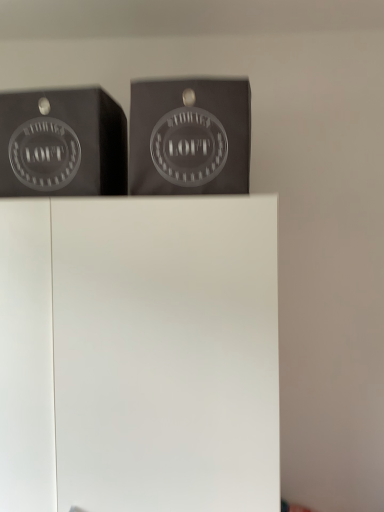
Question: Can you confirm if matte black box at upper center is shorter than matte black logo at upper left?

Choices:
 (A) yes
 (B) no

Answer: (B)

Question: Is matte black box at upper center looking in the opposite direction of matte black logo at upper left?

Choices:
 (A) no
 (B) yes

Answer: (A)

Question: Does matte black box at upper center have a larger size compared to matte black logo at upper left?

Choices:
 (A) yes
 (B) no

Answer: (A)

Question: Is matte black box at upper center outside of matte black logo at upper left?

Choices:
 (A) no
 (B) yes

Answer: (B)

Question: From a real-world perspective, is matte black box at upper center over matte black logo at upper left?

Choices:
 (A) yes
 (B) no

Answer: (B)

Question: Considering the relative positions of matte black logo at upper left and matte black box at upper center in the image provided, is matte black logo at upper left to the left or to the right of matte black box at upper center?

Choices:
 (A) right
 (B) left

Answer: (B)

Question: Is point (16, 161) closer or farther from the camera than point (168, 185)?

Choices:
 (A) farther
 (B) closer

Answer: (A)

Question: From a real-world perspective, is matte black logo at upper left positioned above or below matte black box at upper center?

Choices:
 (A) above
 (B) below

Answer: (A)

Question: Looking at their shapes, would you say matte black logo at upper left is wider or thinner than matte black box at upper center?

Choices:
 (A) thin
 (B) wide

Answer: (B)

Question: Is point (243, 120) closer or farther from the camera than point (104, 448)?

Choices:
 (A) closer
 (B) farther

Answer: (A)

Question: In terms of width, does matte black box at upper center look wider or thinner when compared to white matte cabinet at center?

Choices:
 (A) wide
 (B) thin

Answer: (B)

Question: From a real-world perspective, relative to white matte cabinet at center, is matte black box at upper center vertically above or below?

Choices:
 (A) below
 (B) above

Answer: (B)

Question: Is matte black box at upper center inside the boundaries of white matte cabinet at center, or outside?

Choices:
 (A) inside
 (B) outside

Answer: (B)

Question: Is matte black box at upper center bigger or smaller than matte black logo at upper left?

Choices:
 (A) small
 (B) big

Answer: (B)

Question: Is matte black box at upper center in front of or behind matte black logo at upper left in the image?

Choices:
 (A) front
 (B) behind

Answer: (A)